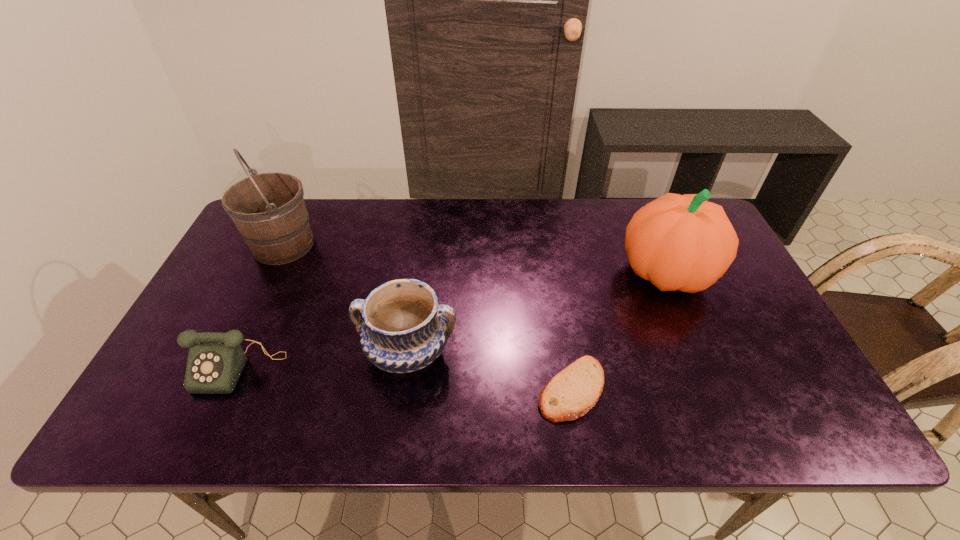
Find the location of `free spot between the bucket and the rightmost object`. free spot between the bucket and the rightmost object is located at coordinates [x=475, y=259].

I want to click on empty space between the telephone and the third object from right to left, so click(324, 360).

You are a GUI agent. You are given a task and a screenshot of the screen. Output one action in this format:
    pyautogui.click(x=<x>, y=<y>)
    Task: Click on the fourth closest object to the bucket
    This screenshot has width=960, height=540.
    Given the screenshot: What is the action you would take?
    pyautogui.click(x=679, y=242)

This screenshot has height=540, width=960. I want to click on the fourth closest object to the third object from right to left, so click(679, 242).

Image resolution: width=960 pixels, height=540 pixels. What are the coordinates of `free location that satisfies the following two spatial constraints: 1. on the front side of the bucket; 2. on the right side of the third shortest object` in the screenshot? It's located at (232, 352).

The width and height of the screenshot is (960, 540). I want to click on vacant position in the image that satisfies the following two spatial constraints: 1. on the back side of the pottery; 2. on the left side of the pumpkin, so click(x=420, y=273).